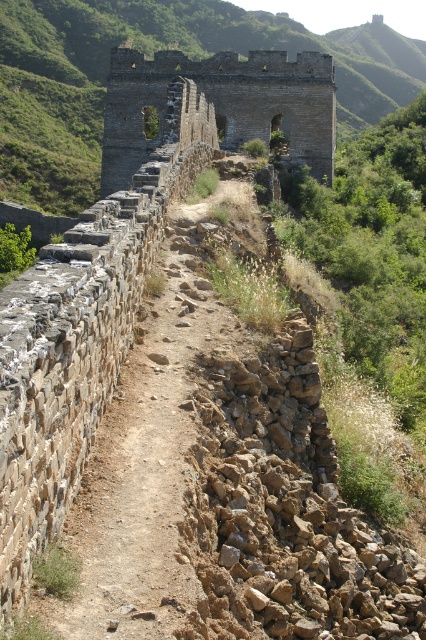
Does brown stone path at center have a greater height compared to stone wall at center?

No.

Does point (193, 547) come in front of point (175, 131)?

Yes, it is.

At what (x,y) coordinates should I click in order to perform the action: click on brown stone path at center. Please return your answer as a coordinate pair (x, y). The height and width of the screenshot is (640, 426). Looking at the image, I should click on (152, 461).